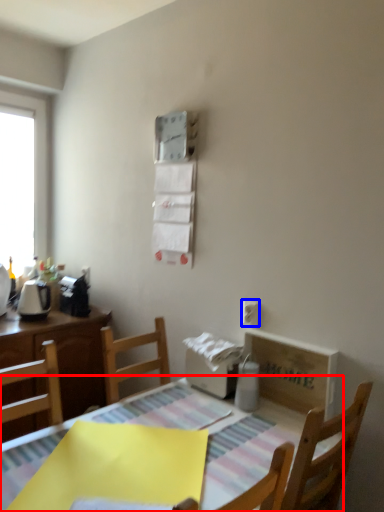
Question: Which object appears farthest to the camera in this image, table (highlighted by a red box) or electric outlet (highlighted by a blue box)?

Choices:
 (A) table
 (B) electric outlet

Answer: (B)